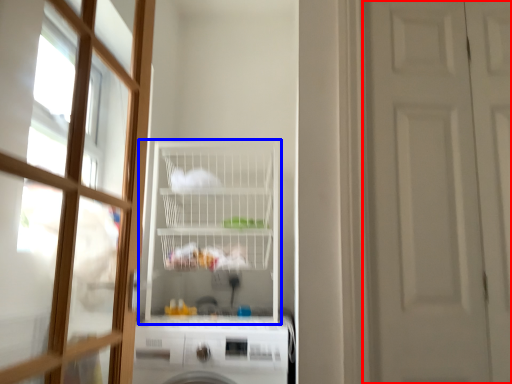
Question: Which object is closer to the camera taking this photo, door (highlighted by a red box) or shelf (highlighted by a blue box)?

Choices:
 (A) door
 (B) shelf

Answer: (A)